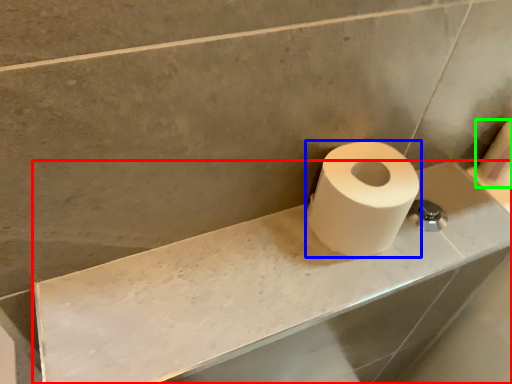
Question: Which object is positioned farthest from counter top (highlighted by a red box)? Select from toilet paper (highlighted by a blue box) and toilet paper (highlighted by a green box).

Choices:
 (A) toilet paper
 (B) toilet paper

Answer: (B)